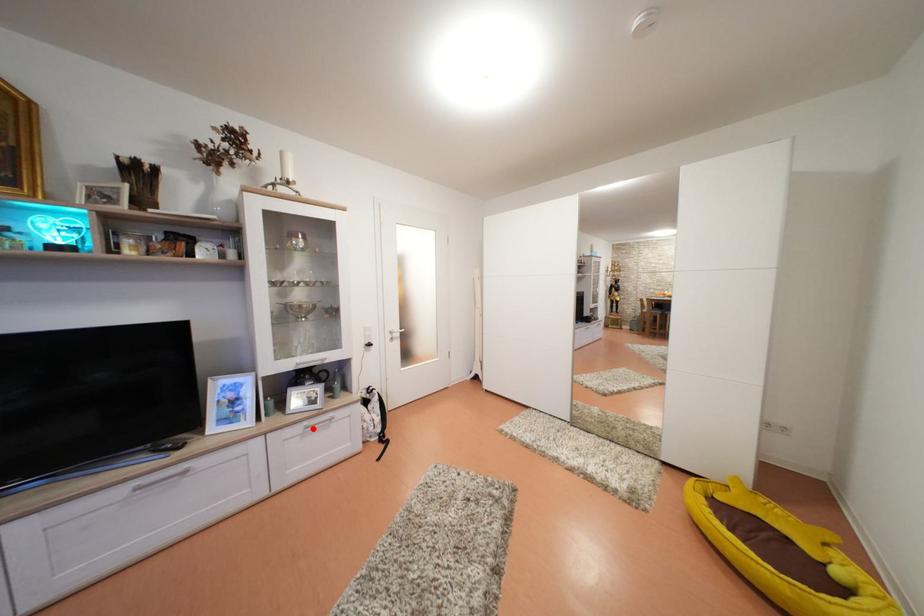
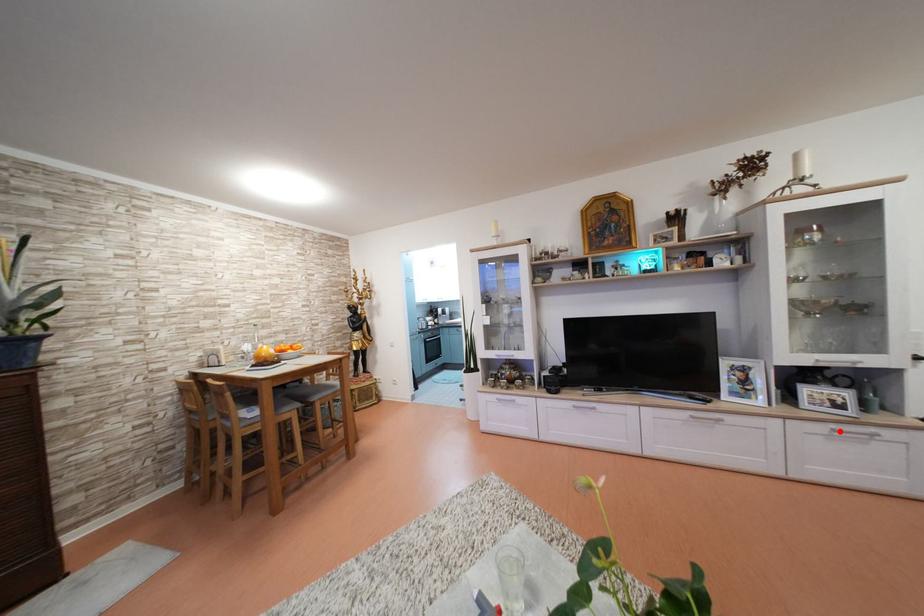
I am providing you with two images of the same scene from different viewpoints. A red point is marked on the first image and another point is marked on the second image. Do the highlighted points in image1 and image2 indicate the same real-world spot?

Yes